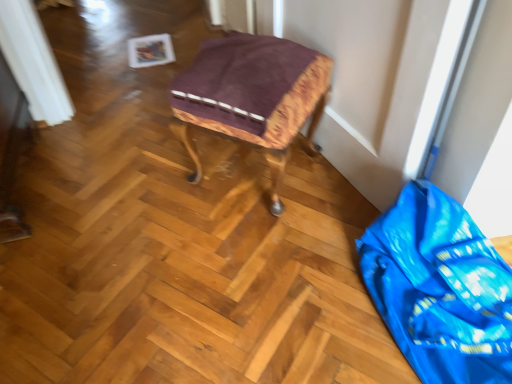
Identify the location of blank space to the left of blue shiny plastic bag at lower right. (292, 299).